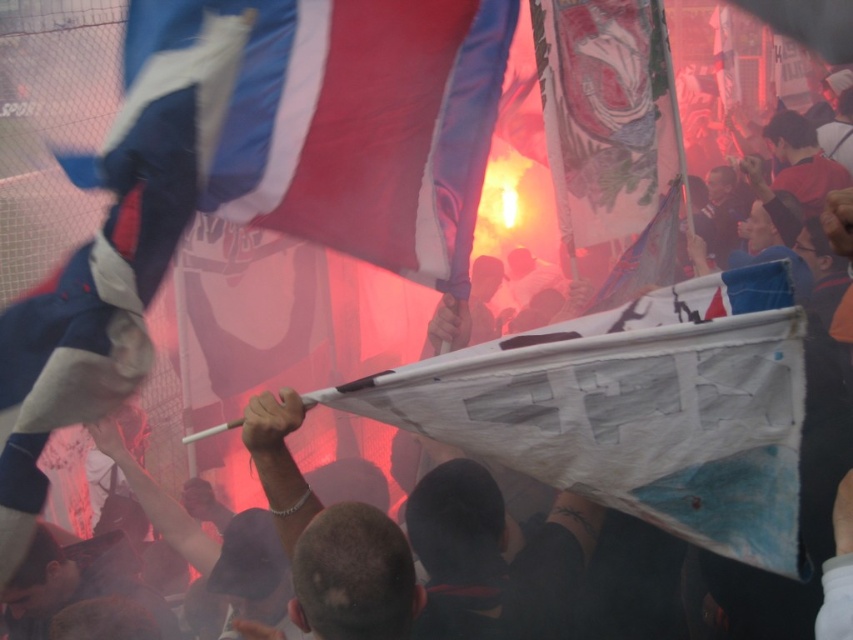
Question: Can you confirm if blue and white fabric flag at upper left is positioned below blue fabric flag at upper left?

Choices:
 (A) yes
 (B) no

Answer: (B)

Question: Which point is closer to the camera?

Choices:
 (A) (305, 49)
 (B) (534, 12)

Answer: (A)

Question: Which point is farther to the camera?

Choices:
 (A) white paper flag at center
 (B) blue and white fabric flag at upper left
 (C) blue fabric flag at upper left

Answer: (A)

Question: Is blue fabric flag at upper left in front of white paper flag at center?

Choices:
 (A) no
 (B) yes

Answer: (B)

Question: Is blue fabric flag at upper left to the left of white paper flag at center from the viewer's perspective?

Choices:
 (A) yes
 (B) no

Answer: (A)

Question: Which object is farther from the camera taking this photo?

Choices:
 (A) blue and white fabric flag at upper left
 (B) blue fabric flag at upper left
 (C) white paper flag at center

Answer: (C)